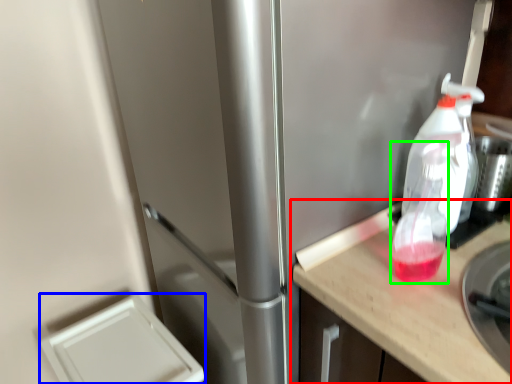
Question: Considering the real-world distances, which object is closest to countertop (highlighted by a red box)? appliance (highlighted by a blue box) or bottle (highlighted by a green box).

Choices:
 (A) appliance
 (B) bottle

Answer: (B)